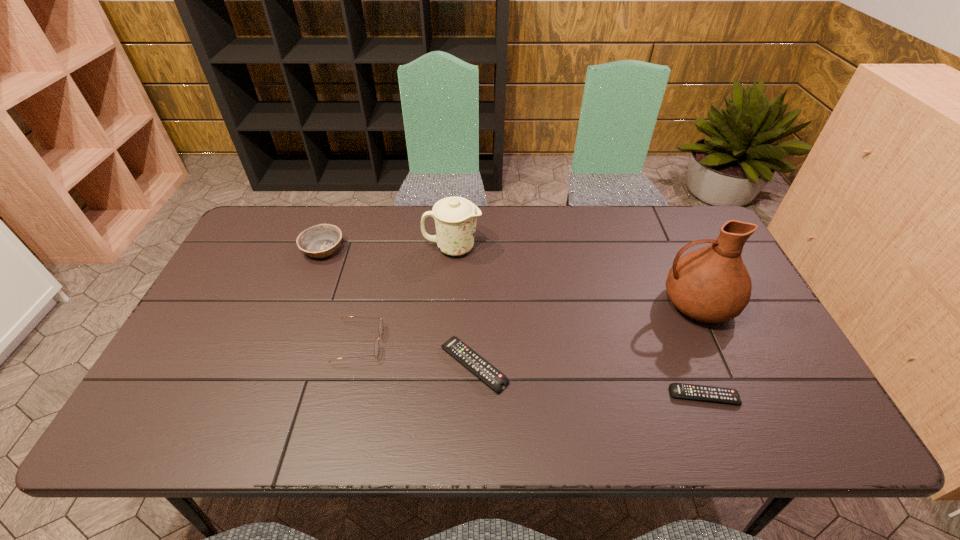
With all remote controls evenly spaced, where should an extra remote control be placed on the left to continue the pattern? Please point out a vacant space. Please provide its 2D coordinates. Your answer should be formatted as a tuple, i.e. [(x, y)], where the tuple contains the x and y coordinates of a point satisfying the conditions above.

[(267, 338)]